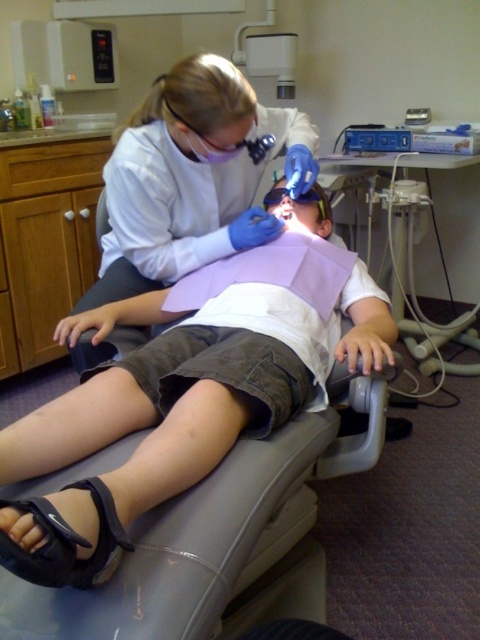
You are a patient entering a dental clinic and see the white glossy lab coat at upper center. Where would you expect to find this item in the clinic?

The white glossy lab coat at upper center is located at point (192, 177) in the image, which corresponds to the upper central area of the clinic, likely near the examination area where dental professionals keep their attire.

You are a dental assistant and need to retrieve the black synthetic sandal at lower left for the child after the procedure. Can you reach it without moving the blue plastic dental chair at center?

The black synthetic sandal at lower left is behind the blue plastic dental chair at center, so you can reach it without moving the chair by going around the side or back of the chair.

You are a dental assistant in the clinic and need to locate the white glossy lab coat at upper center. According to the coordinates provided, where exactly is it placed in the room?

The white glossy lab coat at upper center is placed at coordinates point (192, 177).